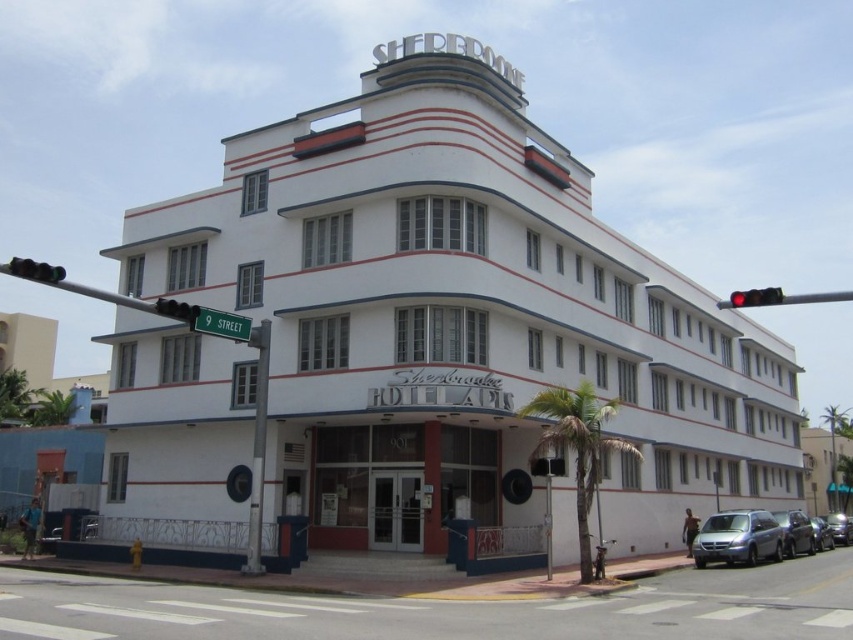
You are standing at the entrance of the white smooth building at center. If you walk straight ahead, will you face the building or the street?

Since the entrance is centrally located on the white smooth building at center, walking straight ahead from the entrance would face you towards the street, not the building itself.

You are a photographer standing at the camera position. You want to capture a photo of the green glass traffic light at upper left without including the building in the frame. Is the traffic light far enough away from the building to allow you to zoom in and focus solely on it?

The green glass traffic light at upper left is 85.05 feet from the camera, so it is far enough away to allow zooming in and focusing solely on it without including the building in the frame.